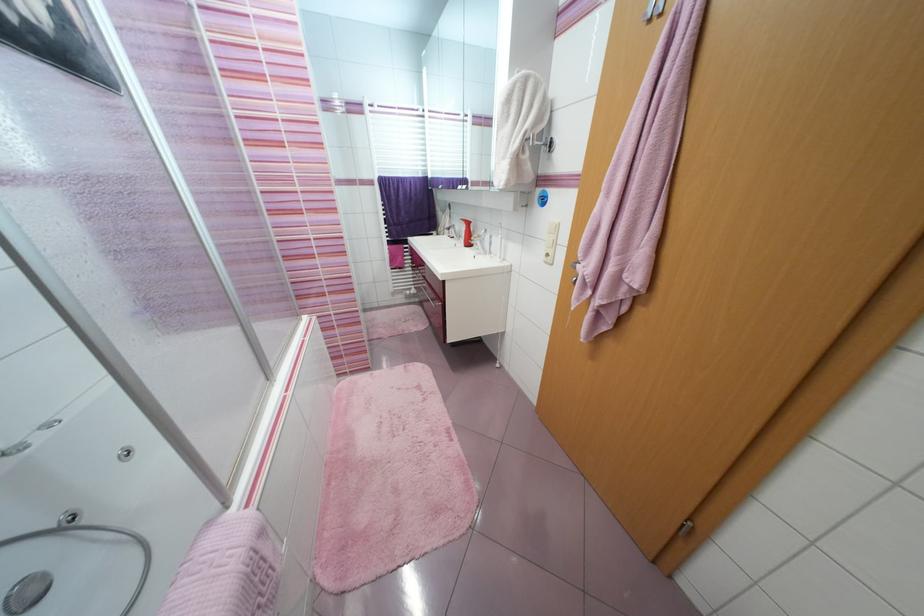
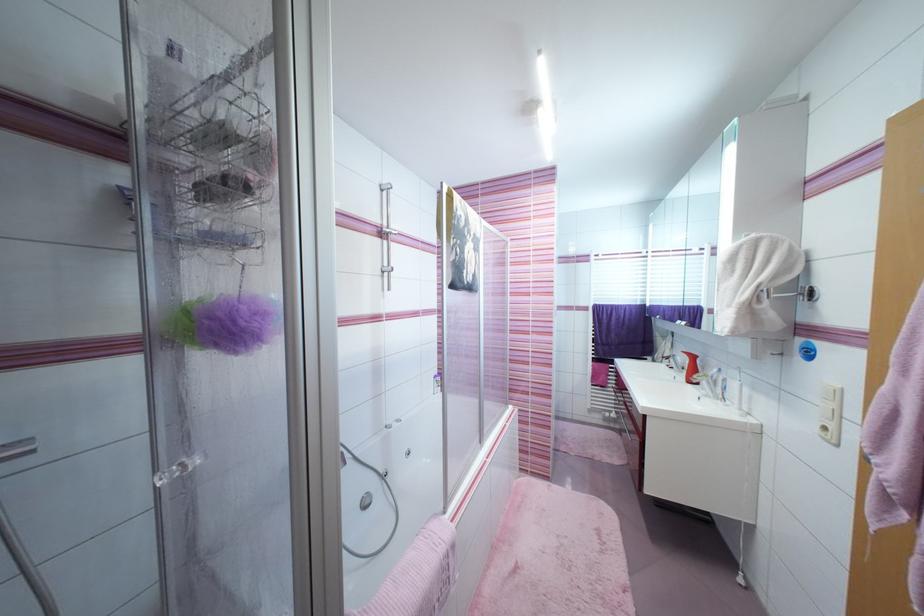
The point at (495, 238) is marked in the first image. Where is the corresponding point in the second image?

(730, 381)